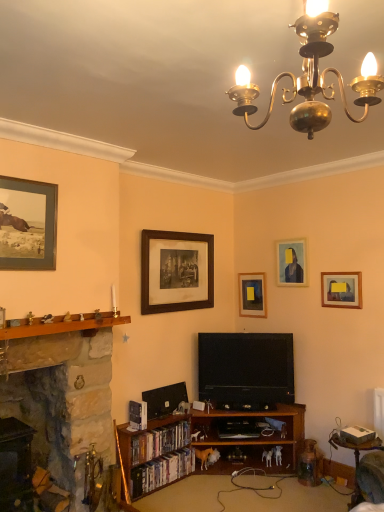
I want to click on vacant location below wooden bookshelf at lower center (from a real-world perspective), so pyautogui.click(x=217, y=489).